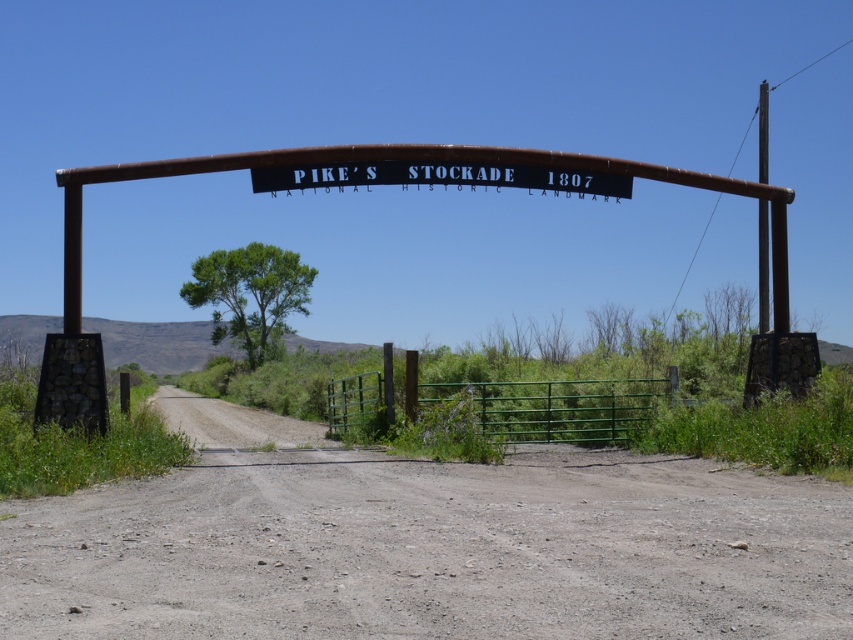
Is dirt/gravel road at center to the right of black metal sign at center from the viewer's perspective?

Correct, you'll find dirt/gravel road at center to the right of black metal sign at center.

Who is more forward, (x=619, y=508) or (x=509, y=182)?

Point (x=619, y=508)

Find the location of a particular element. The height and width of the screenshot is (640, 853). dirt/gravel road at center is located at coordinates (424, 545).